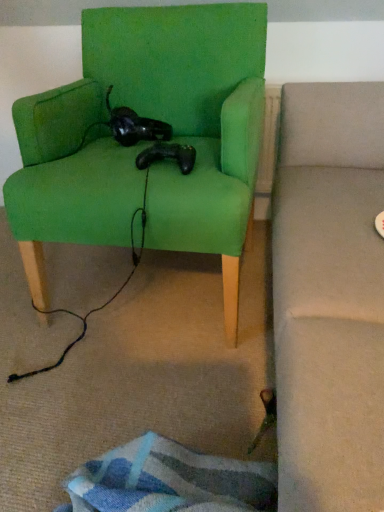
Where is `green fabric chair at center`? The width and height of the screenshot is (384, 512). green fabric chair at center is located at coordinates (142, 145).

Describe the element at coordinates (142, 145) in the screenshot. The width and height of the screenshot is (384, 512). I see `green fabric chair at center` at that location.

Locate an element on the screen. This screenshot has height=512, width=384. black matte controller at center is located at coordinates (168, 156).

What do you see at coordinates (168, 156) in the screenshot? I see `black matte controller at center` at bounding box center [168, 156].

What is the approximate height of black matte controller at center?

It is 2.14 inches.

The width and height of the screenshot is (384, 512). What are the coordinates of `green fabric chair at center` in the screenshot? It's located at (142, 145).

Between black matte controller at center and green fabric chair at center, which one appears on the right side from the viewer's perspective?

Positioned to the right is black matte controller at center.

Between black matte controller at center and green fabric chair at center, which one is positioned in front?

green fabric chair at center is more forward.

Does point (164, 142) come closer to viewer compared to point (58, 202)?

That is False.

From the image's perspective, between black matte controller at center and green fabric chair at center, which one is located above?

green fabric chair at center, from the image's perspective.

From a real-world perspective, is black matte controller at center positioned under green fabric chair at center based on gravity?

Actually, black matte controller at center is physically above green fabric chair at center in the real world.

Can you confirm if black matte controller at center is thinner than green fabric chair at center?

Indeed, black matte controller at center has a lesser width compared to green fabric chair at center.

Is black matte controller at center taller or shorter than green fabric chair at center?

Clearly, black matte controller at center is shorter compared to green fabric chair at center.

Which of these two, black matte controller at center or green fabric chair at center, is smaller?

black matte controller at center.

Does black matte controller at center contain green fabric chair at center?

No.

Can you see black matte controller at center touching green fabric chair at center?

No, black matte controller at center is not making contact with green fabric chair at center.

Could you tell me if black matte controller at center is facing green fabric chair at center?

Yes, black matte controller at center is aimed at green fabric chair at center.

What's the angular difference between black matte controller at center and green fabric chair at center's facing directions?

The angular difference between black matte controller at center and green fabric chair at center is 0.000412 degrees.

Locate an element on the screen. Image resolution: width=384 pixels, height=512 pixels. animal behind the green fabric chair at center is located at coordinates (168, 156).

Which object is positioned more to the right, green fabric chair at center or black matte controller at center?

black matte controller at center is more to the right.

Relative to black matte controller at center, is green fabric chair at center in front or behind?

In the image, green fabric chair at center appears in front of black matte controller at center.

Considering the positions of points (112, 198) and (158, 141), is point (112, 198) farther from camera compared to point (158, 141)?

No, (112, 198) is in front of (158, 141).

From the image's perspective, does green fabric chair at center appear lower than black matte controller at center?

Incorrect, from the image's perspective, green fabric chair at center is higher than black matte controller at center.

From a real-world perspective, relative to black matte controller at center, is green fabric chair at center vertically above or below?

Clearly, from a real-world perspective, green fabric chair at center is below black matte controller at center.

Can you confirm if green fabric chair at center is wider than black matte controller at center?

Yes.

Which of these two, green fabric chair at center or black matte controller at center, stands taller?

Standing taller between the two is green fabric chair at center.

Between green fabric chair at center and black matte controller at center, which one has smaller size?

With smaller size is black matte controller at center.

Is green fabric chair at center located outside black matte controller at center?

Yes, green fabric chair at center is outside of black matte controller at center.

Is green fabric chair at center touching black matte controller at center?

They are not placed beside each other.

Is green fabric chair at center turned away from black matte controller at center?

Yes, black matte controller at center is at the back of green fabric chair at center.

Can you tell me how much green fabric chair at center and black matte controller at center differ in facing direction?

green fabric chair at center and black matte controller at center are facing 0.000412 degrees away from each other.

In the image, there is a black matte controller at center. Where is `chair below it (from a real-world perspective)`? This screenshot has width=384, height=512. chair below it (from a real-world perspective) is located at coordinates (142, 145).

In the image, there is a black matte controller at center. Where is `chair below it (from a real-world perspective)`? This screenshot has width=384, height=512. chair below it (from a real-world perspective) is located at coordinates (142, 145).

Identify the location of chair lying on the left of black matte controller at center. (142, 145).